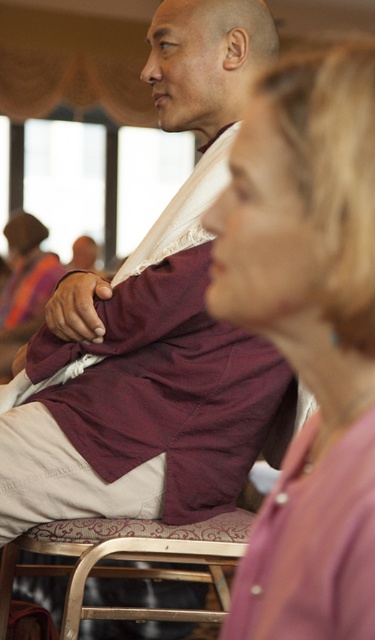
Which is behind, point (274, 218) or point (328, 609)?

The point (274, 218) is more distant.

Can you confirm if pink fabric shirt at center is positioned below pink fabric at lower right?

No.

Describe the element at coordinates (307, 337) in the screenshot. I see `pink fabric shirt at center` at that location.

The image size is (375, 640). Identify the location of pink fabric shirt at center. (307, 337).